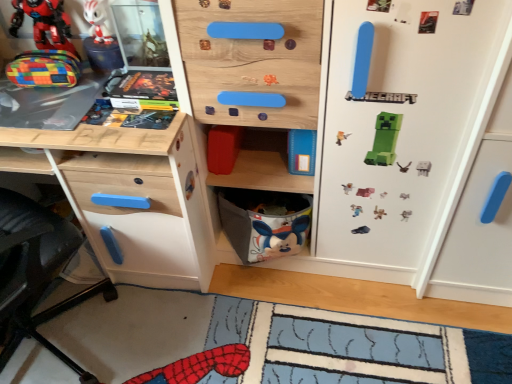
Question: Considering the positions of wooden board game at upper left and matte plastic toy at upper left, positioned as the second toy in top-to-bottom order, in the image, is wooden board game at upper left wider or thinner than matte plastic toy at upper left, positioned as the second toy in top-to-bottom order,?

Choices:
 (A) thin
 (B) wide

Answer: (B)

Question: From the image's perspective, relative to matte plastic toy at upper left, placed as the second toy when sorted from bottom to top, is wooden board game at upper left above or below?

Choices:
 (A) below
 (B) above

Answer: (A)

Question: Which of these objects is positioned closest to the wooden desk at left?

Choices:
 (A) white matte fridge at center
 (B) gray fabric basket at lower center
 (C) hardcover comic book at upper left
 (D) white glossy figurine at upper left, marked as the third toy in a bottom-to-top arrangement
 (E) matte plastic toy at upper left, positioned as the second toy in top-to-bottom order

Answer: (B)

Question: Estimate the real-world distances between objects in this image. Which object is closer to the gray fabric basket at lower center?

Choices:
 (A) wooden desk at left
 (B) hardcover comic book at upper left
 (C) matte plastic toy at upper left, positioned as the second toy in top-to-bottom order
 (D) multicolored fabric pouch at left, which is the third toy from top to bottom
 (E) wooden board game at upper left

Answer: (A)